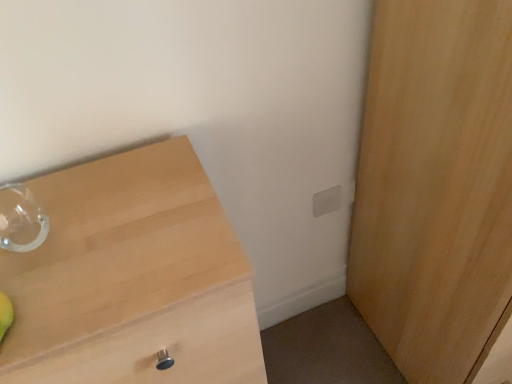
Question: From a real-world perspective, is light wood chest of drawers at left positioned over white matte electric outlet at upper right based on gravity?

Choices:
 (A) yes
 (B) no

Answer: (B)

Question: From a real-world perspective, does light wood chest of drawers at left sit lower than white matte electric outlet at upper right?

Choices:
 (A) yes
 (B) no

Answer: (A)

Question: Is light wood chest of drawers at left placed right next to white matte electric outlet at upper right?

Choices:
 (A) no
 (B) yes

Answer: (A)

Question: Can you confirm if light wood chest of drawers at left is taller than white matte electric outlet at upper right?

Choices:
 (A) yes
 (B) no

Answer: (A)

Question: Is light wood chest of drawers at left far from white matte electric outlet at upper right?

Choices:
 (A) yes
 (B) no

Answer: (B)

Question: Considering the positions of light wood chest of drawers at left and light wood cupboard at right in the image, is light wood chest of drawers at left bigger or smaller than light wood cupboard at right?

Choices:
 (A) big
 (B) small

Answer: (A)

Question: Is light wood chest of drawers at left wider or thinner than light wood cupboard at right?

Choices:
 (A) thin
 (B) wide

Answer: (A)

Question: Considering their positions, is light wood chest of drawers at left located in front of or behind light wood cupboard at right?

Choices:
 (A) front
 (B) behind

Answer: (A)

Question: From a real-world perspective, relative to light wood cupboard at right, is light wood chest of drawers at left vertically above or below?

Choices:
 (A) below
 (B) above

Answer: (A)

Question: Is light wood cupboard at right inside or outside of white matte electric outlet at upper right?

Choices:
 (A) inside
 (B) outside

Answer: (B)

Question: Visually, is light wood cupboard at right positioned to the left or to the right of white matte electric outlet at upper right?

Choices:
 (A) right
 (B) left

Answer: (A)

Question: From a real-world perspective, is light wood cupboard at right physically located above or below white matte electric outlet at upper right?

Choices:
 (A) above
 (B) below

Answer: (A)

Question: Is point (349, 294) positioned closer to the camera than point (325, 193)?

Choices:
 (A) closer
 (B) farther

Answer: (B)

Question: Is light wood chest of drawers at left taller or shorter than white matte electric outlet at upper right?

Choices:
 (A) tall
 (B) short

Answer: (A)

Question: From a real-world perspective, is light wood chest of drawers at left physically located above or below white matte electric outlet at upper right?

Choices:
 (A) below
 (B) above

Answer: (A)